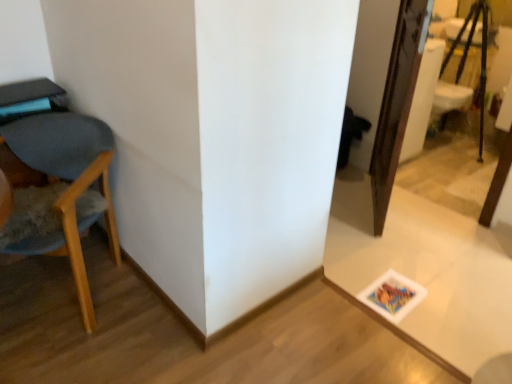
In order to face wooden chair at left, should I rotate leftwards or rightwards?

To face it directly, rotate left by 25.433 degrees.

This screenshot has width=512, height=384. I want to click on white glossy table at lower right, so click(x=426, y=269).

This screenshot has height=384, width=512. In order to click on wooden chair at left in this screenshot , I will do `click(63, 179)`.

Is wooden tripod at upper right with wooden chair at left?

No, wooden tripod at upper right is not next to wooden chair at left.

Locate an element on the screen. mirror that is behind the wooden chair at left is located at coordinates (500, 188).

From the image's perspective, is wooden tripod at upper right positioned above or below wooden chair at left?

wooden tripod at upper right is above wooden chair at left.

From the image's perspective, relative to wooden tripod at upper right, is white glossy table at lower right above or below?

white glossy table at lower right is situated lower than wooden tripod at upper right in the image.

Is white glossy table at lower right facing away from wooden tripod at upper right?

No, white glossy table at lower right is not facing away from wooden tripod at upper right.

Which object is positioned more to the right, white glossy table at lower right or wooden tripod at upper right?

wooden tripod at upper right is more to the right.

Are white glossy table at lower right and wooden tripod at upper right located far from each other?

That's right, there is a large distance between white glossy table at lower right and wooden tripod at upper right.

Is white glossy table at lower right surrounded by wooden tripod at upper right?

No, white glossy table at lower right is not inside wooden tripod at upper right.

Which is in front, point (481, 53) or point (383, 239)?

The point (383, 239) is more forward.

Between wooden tripod at upper right and white glossy table at lower right, which one has smaller size?

white glossy table at lower right is smaller.

In the scene shown: From the image's perspective, is wooden chair at left on top of wooden tripod at upper right?

No, from the image's perspective, wooden chair at left is not above wooden tripod at upper right.

Considering the relative sizes of wooden chair at left and wooden tripod at upper right in the image provided, is wooden chair at left bigger than wooden tripod at upper right?

Indeed, wooden chair at left has a larger size compared to wooden tripod at upper right.

Is wooden chair at left aimed at wooden tripod at upper right?

No.

In the image, is white glossy table at lower right on the left side or the right side of wooden chair at left?

From the image, it's evident that white glossy table at lower right is to the right of wooden chair at left.

Does white glossy table at lower right have a greater height compared to wooden chair at left?

Incorrect, the height of white glossy table at lower right is not larger of that of wooden chair at left.

From a real-world perspective, which object stands above the other?

In real-world perspective, wooden chair at left is above.

In the scene shown: How many degrees apart are the facing directions of wooden chair at left and white glossy table at lower right?

The angle between the facing direction of wooden chair at left and the facing direction of white glossy table at lower right is 33 degrees.

Which of these two, wooden chair at left or white glossy table at lower right, is bigger?

Bigger between the two is wooden chair at left.

Which object is thinner, wooden chair at left or white glossy table at lower right?

wooden chair at left is thinner.

At what (x,y) coordinates should I click in order to perform the action: click on chair in front of the wooden tripod at upper right. Please return your answer as a coordinate pair (x, y). Looking at the image, I should click on (63, 179).

Where is `table below the wooden tripod at upper right (from the image's perspective)`? table below the wooden tripod at upper right (from the image's perspective) is located at coordinates (426, 269).

Looking at the image, which one is located closer to wooden chair at left, wooden tripod at upper right or white glossy table at lower right?

white glossy table at lower right is positioned closer to the anchor wooden chair at left.

Consider the image. From the image, which object appears to be farther from wooden tripod at upper right, wooden chair at left or white glossy table at lower right?

wooden chair at left lies further to wooden tripod at upper right than the other object.

Which object lies further to the anchor point wooden tripod at upper right, white glossy table at lower right or wooden chair at left?

wooden chair at left is positioned further to the anchor wooden tripod at upper right.

Estimate the real-world distances between objects in this image. Which object is further from wooden chair at left, white glossy table at lower right or wooden tripod at upper right?

wooden tripod at upper right is positioned further to the anchor wooden chair at left.

Consider the image. From the image, which object appears to be nearer to white glossy table at lower right, wooden chair at left or wooden tripod at upper right?

wooden chair at left is positioned closer to the anchor white glossy table at lower right.

When comparing their distances from white glossy table at lower right, does wooden tripod at upper right or wooden chair at left seem closer?

Based on the image, wooden chair at left appears to be nearer to white glossy table at lower right.

Where is `table between wooden chair at left and wooden tripod at upper right from left to right`? Image resolution: width=512 pixels, height=384 pixels. table between wooden chair at left and wooden tripod at upper right from left to right is located at coordinates (426, 269).